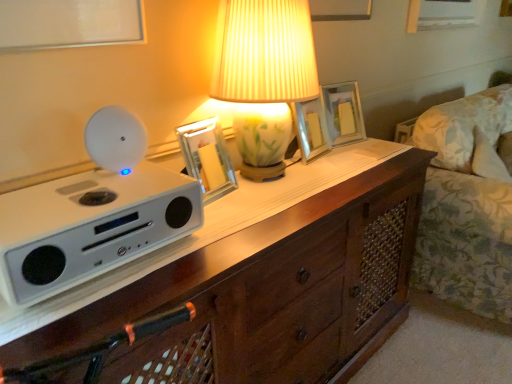
Question: Should I look upward or downward to see white matte speaker at left?

Choices:
 (A) up
 (B) down

Answer: (B)

Question: Does wooden chest of drawers at center touch metallic silver picture frame at center, the 3th picture frame in the back-to-front sequence?

Choices:
 (A) yes
 (B) no

Answer: (B)

Question: From the image's perspective, is wooden chest of drawers at center over metallic silver picture frame at center, which is counted as the 1th picture frame, starting from the left?

Choices:
 (A) no
 (B) yes

Answer: (A)

Question: Is wooden chest of drawers at center in front of metallic silver picture frame at center, which is counted as the 1th picture frame, starting from the left?

Choices:
 (A) no
 (B) yes

Answer: (B)

Question: Is wooden chest of drawers at center positioned far away from metallic silver picture frame at center, which is counted as the 1th picture frame, starting from the left?

Choices:
 (A) no
 (B) yes

Answer: (A)

Question: Is wooden chest of drawers at center looking in the opposite direction of metallic silver picture frame at center, positioned as the 1th picture frame in front-to-back order?

Choices:
 (A) yes
 (B) no

Answer: (B)

Question: From a real-world perspective, does wooden chest of drawers at center stand above metallic silver picture frame at center, which is counted as the 1th picture frame, starting from the left?

Choices:
 (A) yes
 (B) no

Answer: (B)

Question: Are porcelain floral lamp at center and matte glass picture frame at center, which appears as the third picture frame when viewed from the left, making contact?

Choices:
 (A) no
 (B) yes

Answer: (A)

Question: Is porcelain floral lamp at center taller than matte glass picture frame at center, which appears as the 1th picture frame when viewed from the back?

Choices:
 (A) no
 (B) yes

Answer: (B)

Question: Is porcelain floral lamp at center to the left of matte glass picture frame at center, which appears as the 3th picture frame when viewed from the front, from the viewer's perspective?

Choices:
 (A) no
 (B) yes

Answer: (B)

Question: Is porcelain floral lamp at center not within matte glass picture frame at center, which appears as the 1th picture frame when viewed from the back?

Choices:
 (A) yes
 (B) no

Answer: (A)

Question: From the image's perspective, is porcelain floral lamp at center on top of matte glass picture frame at center, the 1th picture frame from the right?

Choices:
 (A) yes
 (B) no

Answer: (B)

Question: From a real-world perspective, is porcelain floral lamp at center on matte glass picture frame at center, which appears as the 3th picture frame when viewed from the front?

Choices:
 (A) no
 (B) yes

Answer: (B)

Question: Does metallic silver picture frame at center, acting as the second picture frame starting from the front, have a lesser height compared to porcelain floral lamp at center?

Choices:
 (A) yes
 (B) no

Answer: (A)